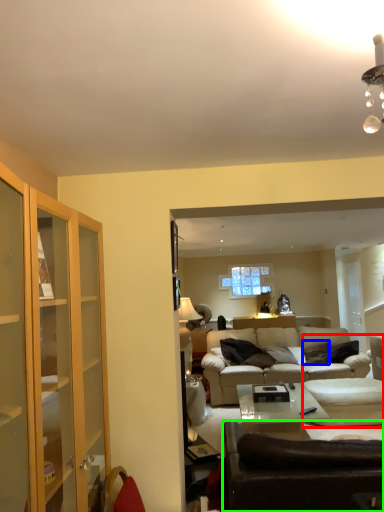
Question: Based on their relative distances, which object is farther from swivel chair (highlighted by a red box)? Choose from pillow (highlighted by a blue box) and studio couch (highlighted by a green box).

Choices:
 (A) pillow
 (B) studio couch

Answer: (B)